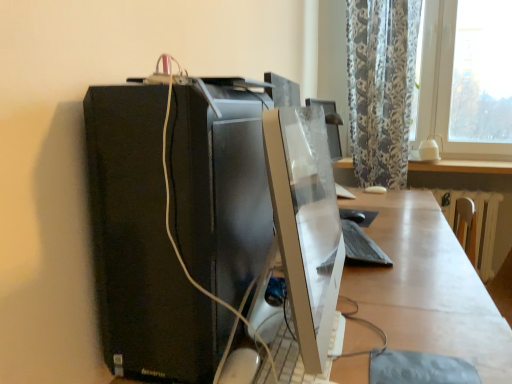
Question: Can you confirm if white glossy table at lower right is thinner than white glossy desk at center?

Choices:
 (A) yes
 (B) no

Answer: (A)

Question: Is white glossy table at lower right further to the viewer compared to white glossy desk at center?

Choices:
 (A) no
 (B) yes

Answer: (B)

Question: Is white glossy table at lower right turned away from white glossy desk at center?

Choices:
 (A) no
 (B) yes

Answer: (A)

Question: Does white glossy table at lower right have a smaller size compared to white glossy desk at center?

Choices:
 (A) yes
 (B) no

Answer: (A)

Question: Is white glossy table at lower right shorter than white glossy desk at center?

Choices:
 (A) no
 (B) yes

Answer: (B)

Question: Does white glossy table at lower right have a greater width compared to white glossy desk at center?

Choices:
 (A) no
 (B) yes

Answer: (A)

Question: Is white glossy desk at center facing away from black matte keyboard at center?

Choices:
 (A) no
 (B) yes

Answer: (A)

Question: Is white glossy desk at center not near black matte keyboard at center?

Choices:
 (A) no
 (B) yes

Answer: (A)

Question: From the image's perspective, is white glossy desk at center below black matte keyboard at center?

Choices:
 (A) no
 (B) yes

Answer: (B)

Question: From the image's perspective, does white glossy desk at center appear higher than black matte keyboard at center?

Choices:
 (A) no
 (B) yes

Answer: (A)

Question: Is white glossy desk at center positioned beyond the bounds of black matte keyboard at center?

Choices:
 (A) yes
 (B) no

Answer: (A)

Question: Considering the relative sizes of white glossy desk at center and black matte keyboard at center in the image provided, is white glossy desk at center smaller than black matte keyboard at center?

Choices:
 (A) yes
 (B) no

Answer: (B)

Question: Does white glossy table at lower right appear on the right side of satin white monitor at center?

Choices:
 (A) yes
 (B) no

Answer: (A)